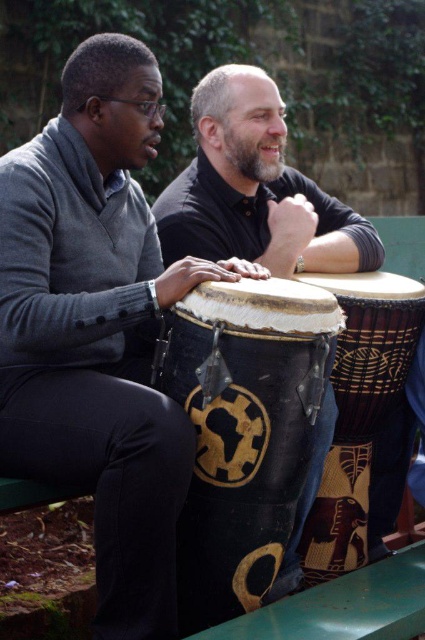
You are a photographer standing in front of the two people in the image. You want to focus on the point closer to you to capture a sharp image. Which point should you choose between point (178,481) and point (229,339)?

Point (178,481) is closer to the camera than point (229,339), so you should choose point (178,481) to focus on for a sharp image.

You are a photographer setting up a shot of the two people. You want to ensure that both the matte black drum at left and the smooth black shirt at center are clearly visible in the frame. Based on their positions, which object should you focus on first to ensure depth of field captures both?

The matte black drum at left is located below the smooth black shirt at center. To ensure both are in focus, focus on the smooth black shirt at center first since it is closer to the camera, then the depth of field will naturally include the matte black drum at left behind it.

You are standing in front of the two people in the image. There is a point marked at coordinates (243, 433). Which object from the scene does this point belong to?

The point at coordinates (243, 433) is on the black textured drum at center.